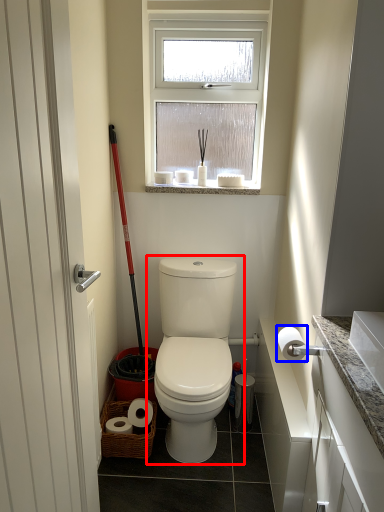
Question: Which object appears farthest to the camera in this image, toilet (highlighted by a red box) or toilet paper (highlighted by a blue box)?

Choices:
 (A) toilet
 (B) toilet paper

Answer: (A)